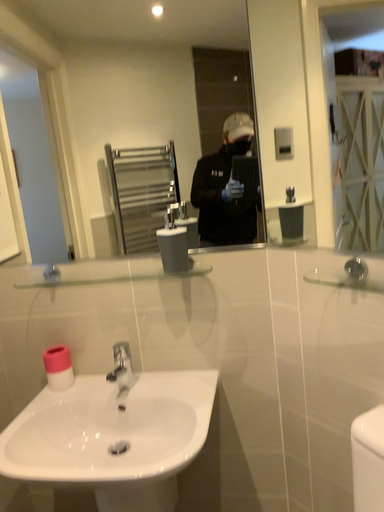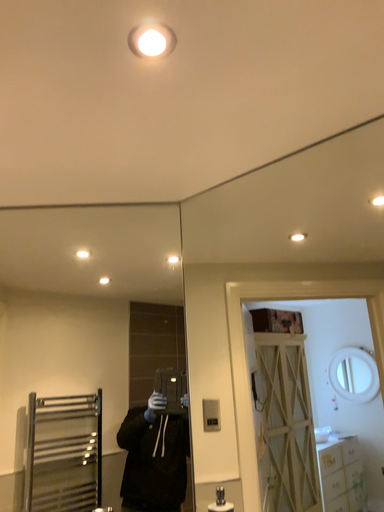
Question: Which way did the camera rotate in the video?

Choices:
 (A) rotated left
 (B) rotated right

Answer: (B)